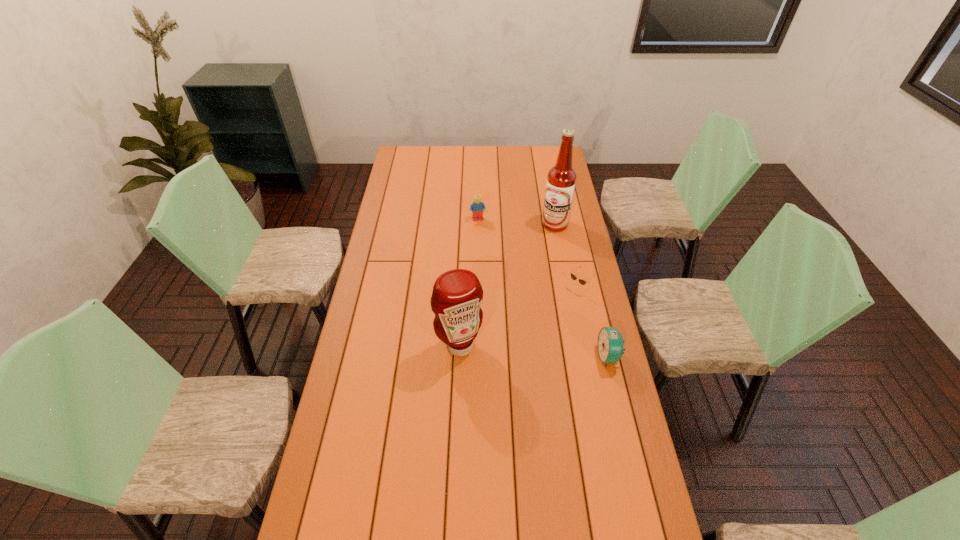
Image resolution: width=960 pixels, height=540 pixels. I want to click on alcohol that is positioned at the right edge, so click(x=561, y=180).

The width and height of the screenshot is (960, 540). I want to click on sunglasses that is at the right edge, so click(x=582, y=282).

At what (x,y) coordinates should I click in order to perform the action: click on blank area at the far edge. Please return your answer as a coordinate pair (x, y). The image size is (960, 540). Looking at the image, I should click on (459, 151).

Locate an element on the screen. This screenshot has height=540, width=960. vacant space at the near edge of the desktop is located at coordinates (388, 531).

I want to click on blank space at the left edge of the desktop, so click(x=384, y=413).

Locate an element on the screen. The width and height of the screenshot is (960, 540). free space at the right edge is located at coordinates (582, 240).

At what (x,y) coordinates should I click in order to perform the action: click on vacant space at the near left corner of the desktop. Please return your answer as a coordinate pair (x, y). The height and width of the screenshot is (540, 960). Looking at the image, I should click on (305, 519).

In the image, there is a desktop. Find the location of `free space at the far right corner`. free space at the far right corner is located at coordinates (551, 166).

Where is `blank region between the alarm clock and the sunglasses`? The height and width of the screenshot is (540, 960). blank region between the alarm clock and the sunglasses is located at coordinates (592, 322).

Image resolution: width=960 pixels, height=540 pixels. In order to click on empty space that is in between the alarm clock and the third farthest object in this screenshot , I will do `click(592, 322)`.